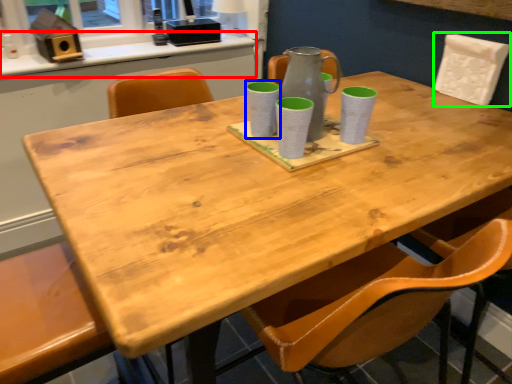
Question: Which object is positioned closest to counter top (highlighted by a red box)? Select from mug (highlighted by a blue box) and chair (highlighted by a green box).

Choices:
 (A) mug
 (B) chair

Answer: (A)